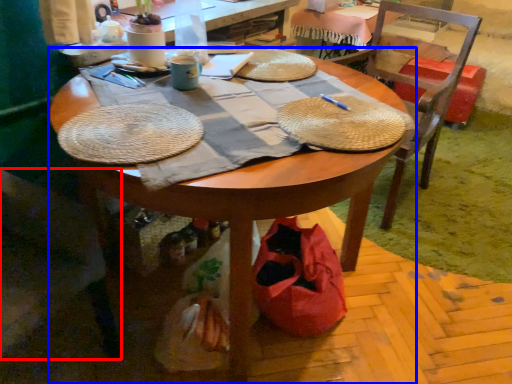
Question: Which object is further to the camera taking this photo, chair (highlighted by a red box) or desk (highlighted by a blue box)?

Choices:
 (A) chair
 (B) desk

Answer: (A)